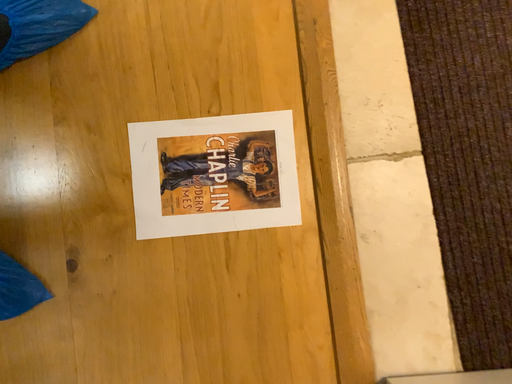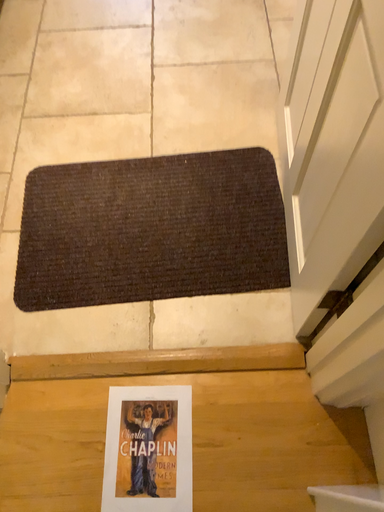
Question: How did the camera likely rotate when shooting the video?

Choices:
 (A) rotated upward
 (B) rotated downward

Answer: (A)